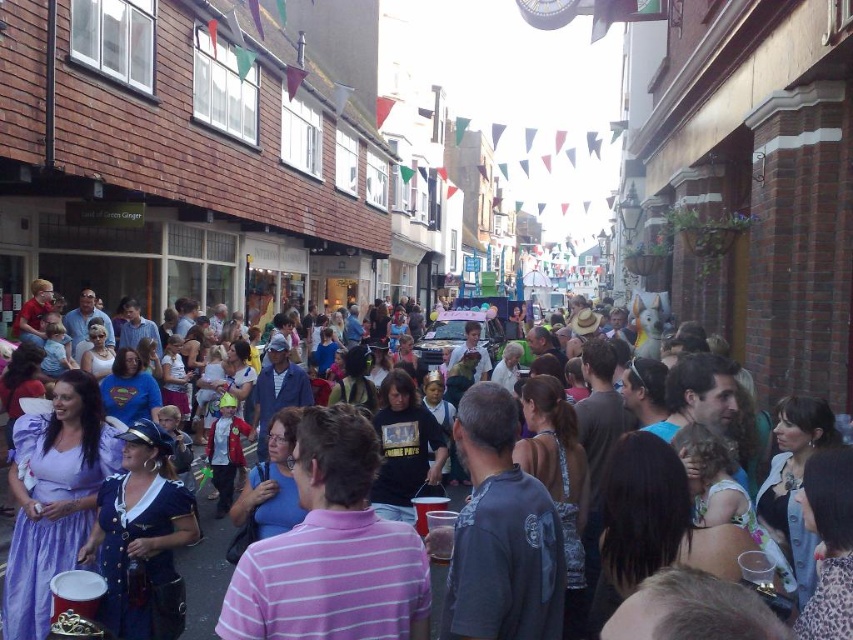
Question: From the image, what is the correct spatial relationship of pink striped shirt at center in relation to matte plastic cup at center?

Choices:
 (A) below
 (B) above

Answer: (B)

Question: Which object appears closest to the camera in this image?

Choices:
 (A) matte plastic cup at center
 (B) pink striped shirt at center

Answer: (B)

Question: Can you confirm if pink striped shirt at center is wider than matte plastic cup at center?

Choices:
 (A) no
 (B) yes

Answer: (A)

Question: Can you confirm if pink striped shirt at center is wider than matte plastic cup at center?

Choices:
 (A) yes
 (B) no

Answer: (B)

Question: Which object appears farthest from the camera in this image?

Choices:
 (A) pink striped shirt at center
 (B) matte plastic cup at center

Answer: (B)